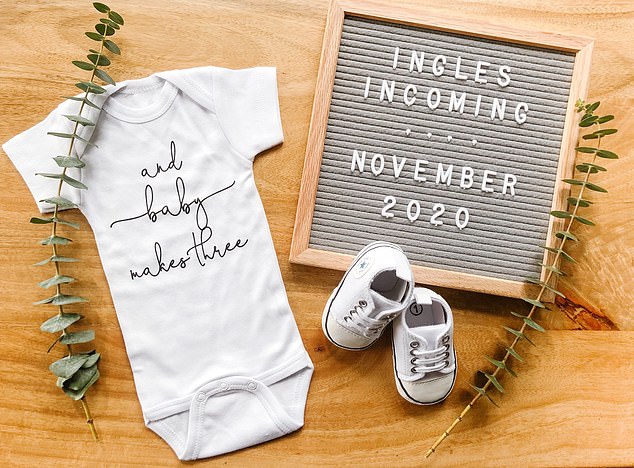
The width and height of the screenshot is (634, 468). In order to click on light brown table in this screenshot , I will do `click(246, 33)`.